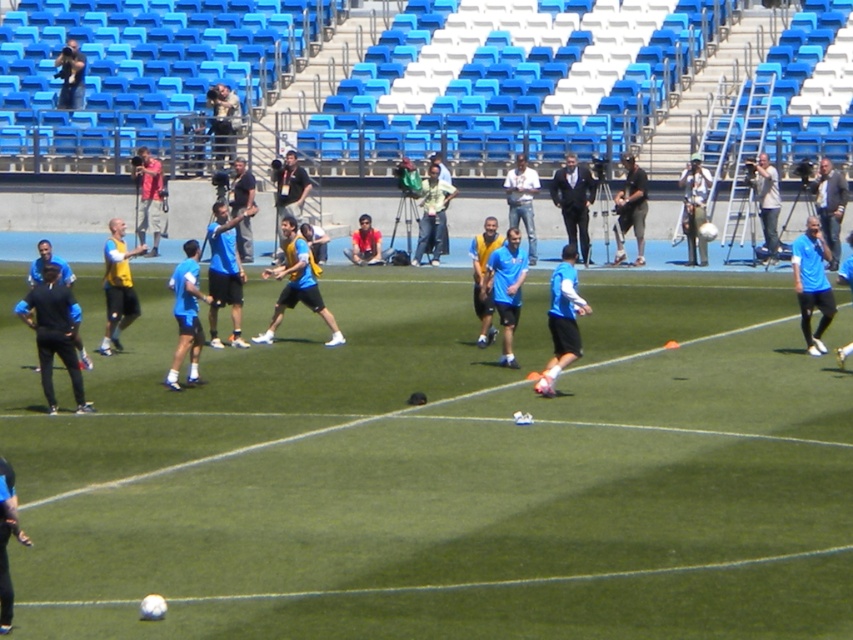
You are a photographer positioned at the back of the stadium. You want to take a clear photo of the soccer training session. There are two points of interest marked as point 1 at coordinate point (506, 324) and point 2 at coordinate point (769, 186). Which point will appear closer to you in the photo?

Point (506, 324) is closer to the camera than point (769, 186), so in the photo, point (506, 324) will appear closer to you.

You are a photographer positioned at the back of the stadium. You need to capture a clear shot of the blue matte soccer players at center without the green artificial turf at center blocking the view. Is this possible given their positions?

The green artificial turf at center is in front of the blue matte soccer players at center, so the turf would block the view of the players. You cannot capture a clear shot of the blue matte soccer players at center without the green artificial turf at center blocking the view.